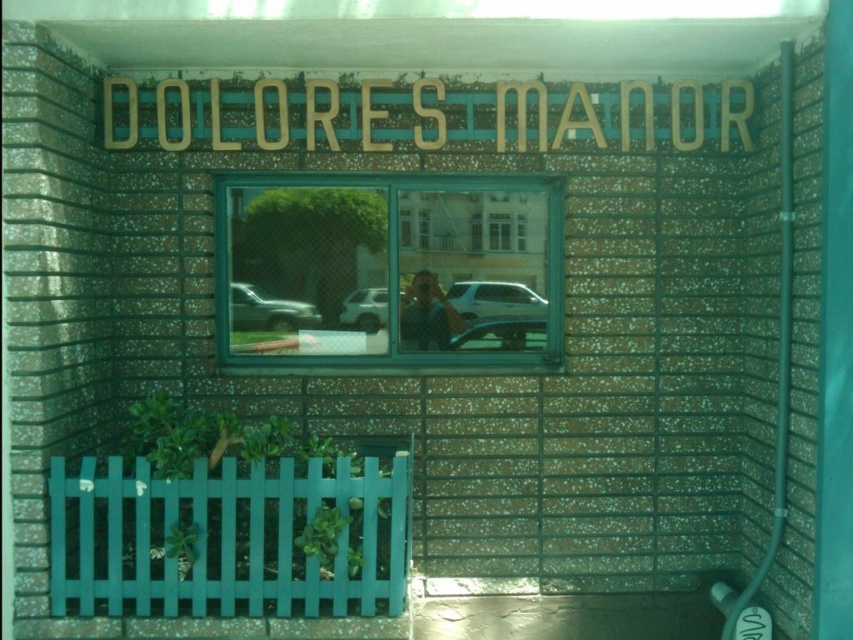
Can you confirm if white matte car at center is taller than clear glass window at center?

Correct, white matte car at center is much taller as clear glass window at center.

Who is more forward, (384, 288) or (488, 240)?

Positioned in front is point (384, 288).

Looking at this image, who is more distant from viewer, (349, 323) or (497, 241)?

Positioned behind is point (497, 241).

Locate an element on the screen. Image resolution: width=853 pixels, height=640 pixels. white matte car at center is located at coordinates (364, 308).

Who is more distant from viewer, (x=149, y=131) or (x=260, y=310)?

Point (x=260, y=310)

Between gold metallic sign at upper center and metallic silver car at center, which one appears on the left side from the viewer's perspective?

From the viewer's perspective, metallic silver car at center appears more on the left side.

Is point (219, 124) farther from camera compared to point (230, 314)?

That is False.

You are a GUI agent. You are given a task and a screenshot of the screen. Output one action in this format:
    pyautogui.click(x=<x>, y=<y>)
    Task: Click on the gold metallic sign at upper center
    Image resolution: width=853 pixels, height=640 pixels.
    Given the screenshot: What is the action you would take?
    pyautogui.click(x=424, y=115)

Describe the element at coordinates (380, 260) in the screenshot. I see `green glass window at center` at that location.

Who is more distant from viewer, (543,221) or (490,237)?

The point (543,221) is behind.

I want to click on green glass window at center, so click(x=380, y=260).

You are a GUI agent. You are given a task and a screenshot of the screen. Output one action in this format:
    pyautogui.click(x=<x>, y=<y>)
    Task: Click on the green glass window at center
    This screenshot has width=853, height=640.
    Given the screenshot: What is the action you would take?
    pyautogui.click(x=380, y=260)